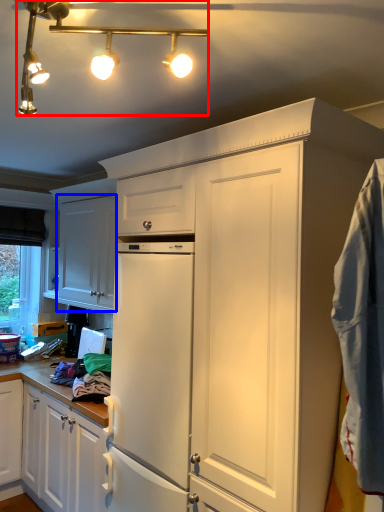
Question: Which object is further to the camera taking this photo, light fixture (highlighted by a red box) or cabinetry (highlighted by a blue box)?

Choices:
 (A) light fixture
 (B) cabinetry

Answer: (B)